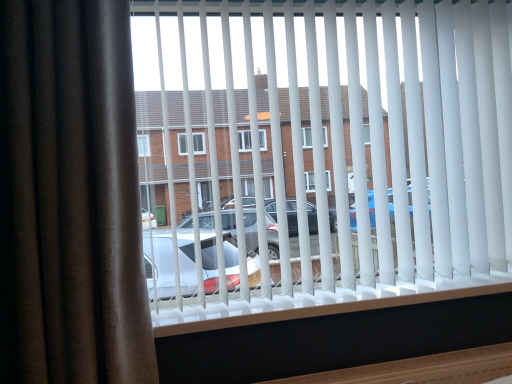
Question: Can you confirm if brown velvet curtain at left is taller than white plastic blinds at center?

Choices:
 (A) no
 (B) yes

Answer: (B)

Question: Is brown velvet curtain at left looking in the opposite direction of white plastic blinds at center?

Choices:
 (A) no
 (B) yes

Answer: (A)

Question: Is white plastic blinds at center surrounded by brown velvet curtain at left?

Choices:
 (A) no
 (B) yes

Answer: (A)

Question: Is brown velvet curtain at left completely or partially outside of white plastic blinds at center?

Choices:
 (A) no
 (B) yes

Answer: (B)

Question: Is brown velvet curtain at left smaller than white plastic blinds at center?

Choices:
 (A) no
 (B) yes

Answer: (B)

Question: Is the depth of brown velvet curtain at left greater than that of white plastic blinds at center?

Choices:
 (A) no
 (B) yes

Answer: (A)

Question: From the image's perspective, does white plastic blinds at center appear lower than brown velvet curtain at left?

Choices:
 (A) no
 (B) yes

Answer: (A)

Question: Would you say brown velvet curtain at left is part of white plastic blinds at center's contents?

Choices:
 (A) yes
 (B) no

Answer: (B)

Question: Is white plastic blinds at center to the right of brown velvet curtain at left from the viewer's perspective?

Choices:
 (A) no
 (B) yes

Answer: (B)

Question: Can you confirm if white plastic blinds at center is shorter than brown velvet curtain at left?

Choices:
 (A) yes
 (B) no

Answer: (A)

Question: Is white plastic blinds at center thinner than brown velvet curtain at left?

Choices:
 (A) no
 (B) yes

Answer: (B)

Question: Is white plastic blinds at center next to brown velvet curtain at left and touching it?

Choices:
 (A) yes
 (B) no

Answer: (B)

Question: In the image, is brown velvet curtain at left on the left side or the right side of white plastic blinds at center?

Choices:
 (A) right
 (B) left

Answer: (B)